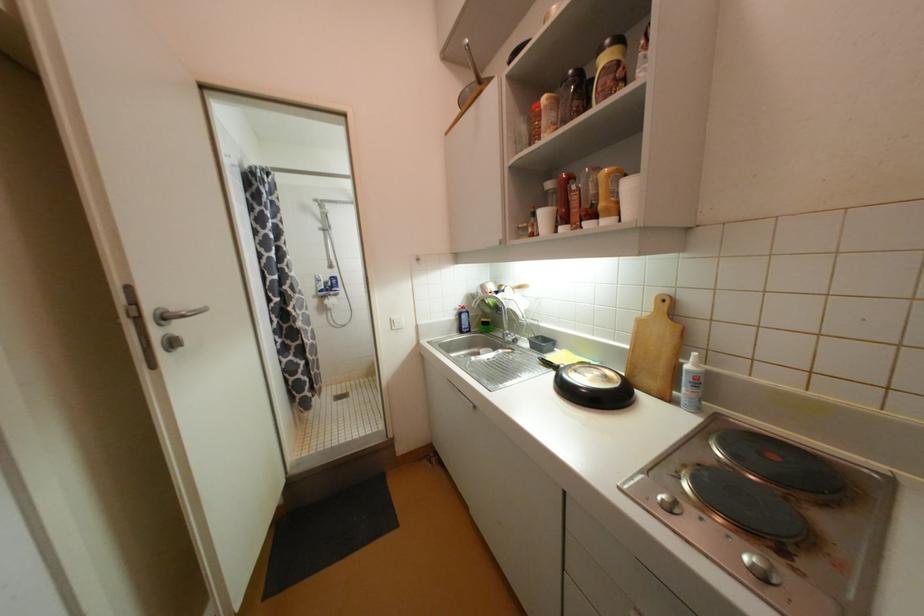
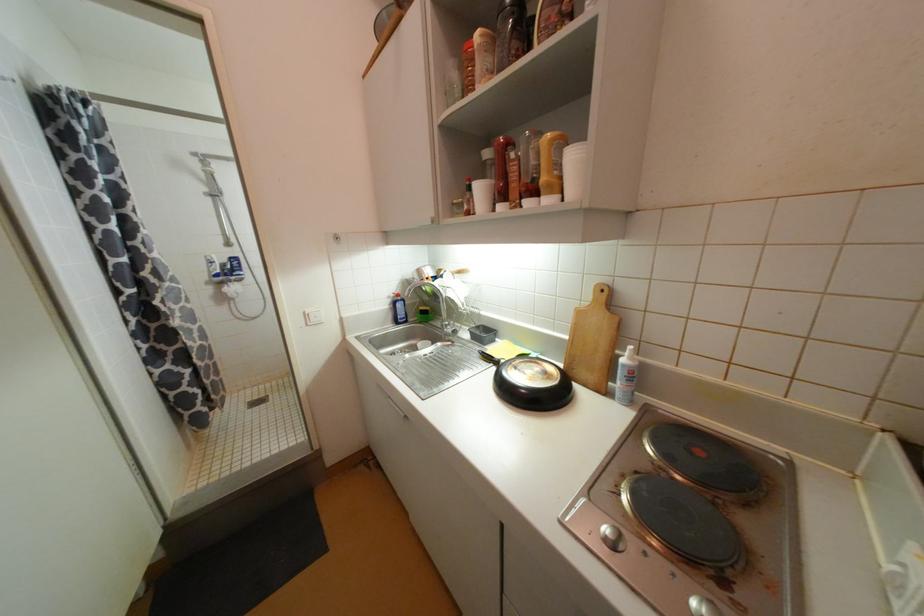
In a continuous first-person perspective shot, in which direction is the camera moving?

The cameraman walked toward right, forward.